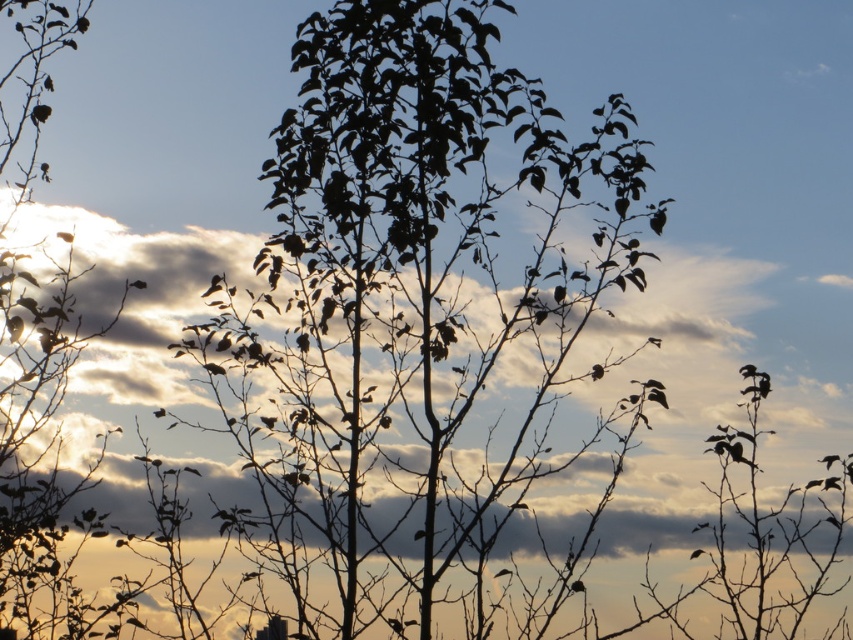
Does silhouette leafy tree at center have a smaller size compared to white fluffy cloud at upper center?

No, silhouette leafy tree at center is not smaller than white fluffy cloud at upper center.

Find the location of a particular element. silhouette leafy tree at center is located at coordinates (412, 282).

You are a GUI agent. You are given a task and a screenshot of the screen. Output one action in this format:
    pyautogui.click(x=<x>, y=<y>)
    Task: Click on the silhouette leafy tree at center
    This screenshot has width=853, height=640.
    Given the screenshot: What is the action you would take?
    pyautogui.click(x=412, y=282)